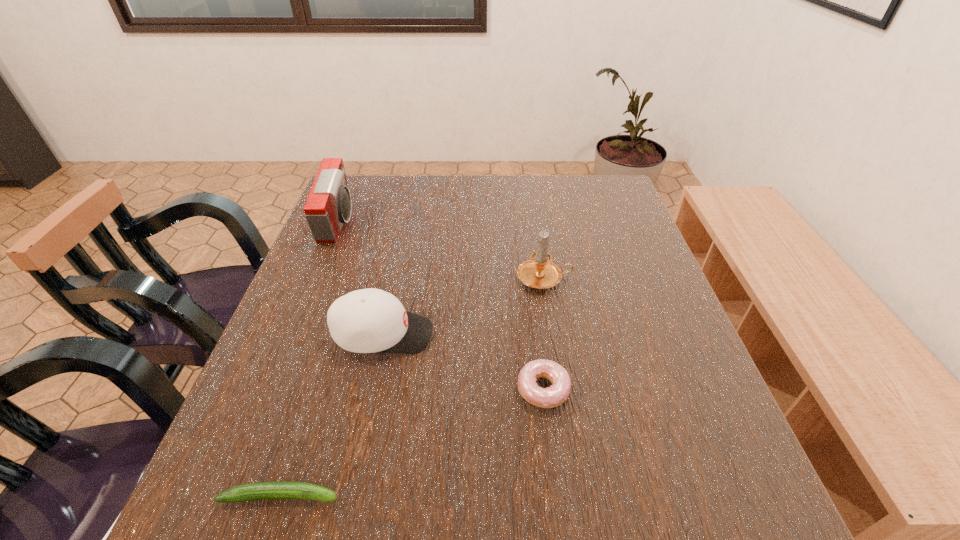
Find the location of a particular element. blank area located on the front-facing side of the third nearest object is located at coordinates (499, 334).

Find the location of a particular element. This screenshot has width=960, height=540. free region located 0.230m on the right of the second nearest object is located at coordinates (693, 389).

This screenshot has height=540, width=960. I want to click on free point located 0.400m on the front-facing side of the nearest object, so click(599, 496).

At what (x,y) coordinates should I click in order to perform the action: click on object that is at the far edge. Please return your answer as a coordinate pair (x, y). This screenshot has height=540, width=960. Looking at the image, I should click on (328, 206).

Locate an element on the screen. object located in the near edge section of the desktop is located at coordinates (262, 490).

I want to click on camera present at the left edge, so pyautogui.click(x=328, y=206).

The width and height of the screenshot is (960, 540). I want to click on baseball cap at the left edge, so click(370, 320).

This screenshot has width=960, height=540. Identify the location of zucchini that is positioned at the left edge. (262, 490).

Locate an element on the screen. The width and height of the screenshot is (960, 540). object that is at the far left corner is located at coordinates (328, 206).

Where is `object located at the near left corner`? The image size is (960, 540). object located at the near left corner is located at coordinates pos(262,490).